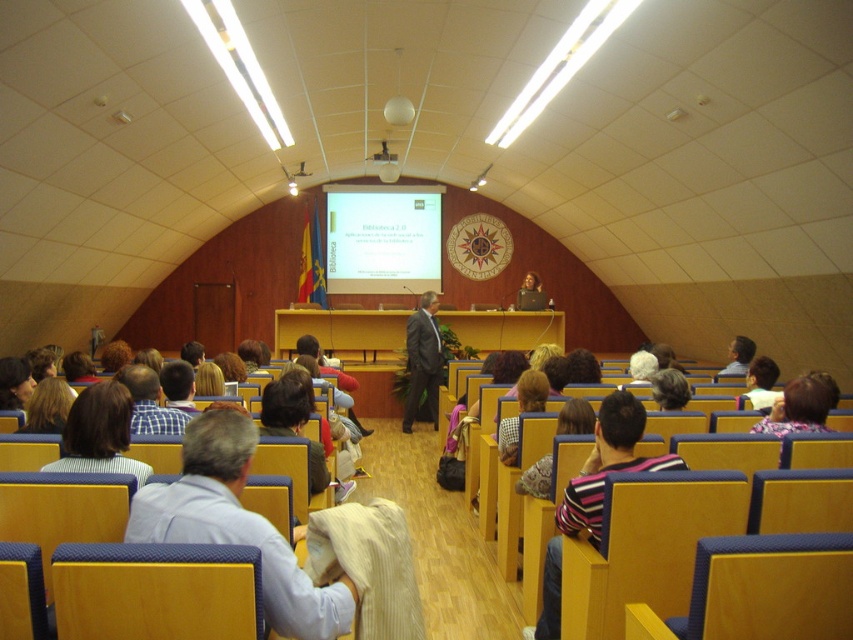
You are sitting in the front row of the lecture hall and notice both the striped shirt at lower left and the matte black laptop at center. Which object is nearer to you?

The striped shirt at lower left is closer to the viewer than the matte black laptop at center.

You are an event organizer in the lecture hall and need to seat two speakers. The first speaker is wearing the light blue fabric shirt at center, and the second speaker is wearing the striped fabric shirt at right. If you want to place them on the stage such that the speaker with the larger shirt is closer to the podium, which speaker should stand where?

The striped fabric shirt at right is larger than the light blue fabric shirt at center. Therefore, the speaker wearing the striped fabric shirt at right should stand closer to the podium to comply with the requirement.

What are the coordinates of the light blue fabric shirt at center?

The light blue fabric shirt at center is located at coordinates point (236, 525).